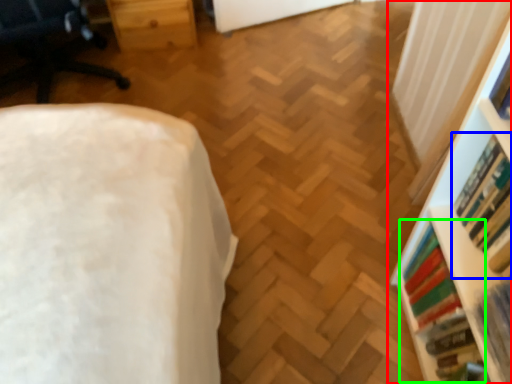
Question: Which is nearer to the shelf (highlighted by a red box)? book (highlighted by a blue box) or book (highlighted by a green box).

Choices:
 (A) book
 (B) book

Answer: (B)